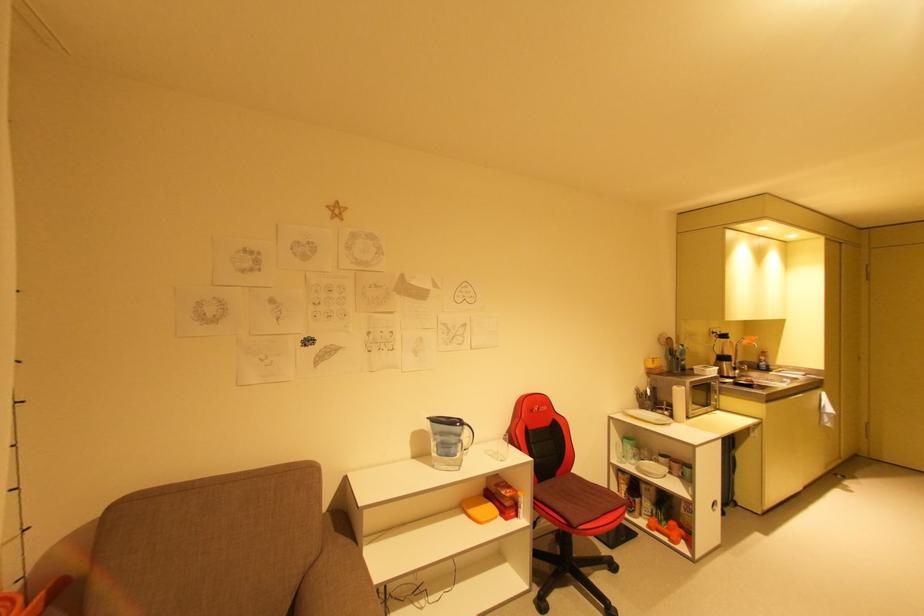
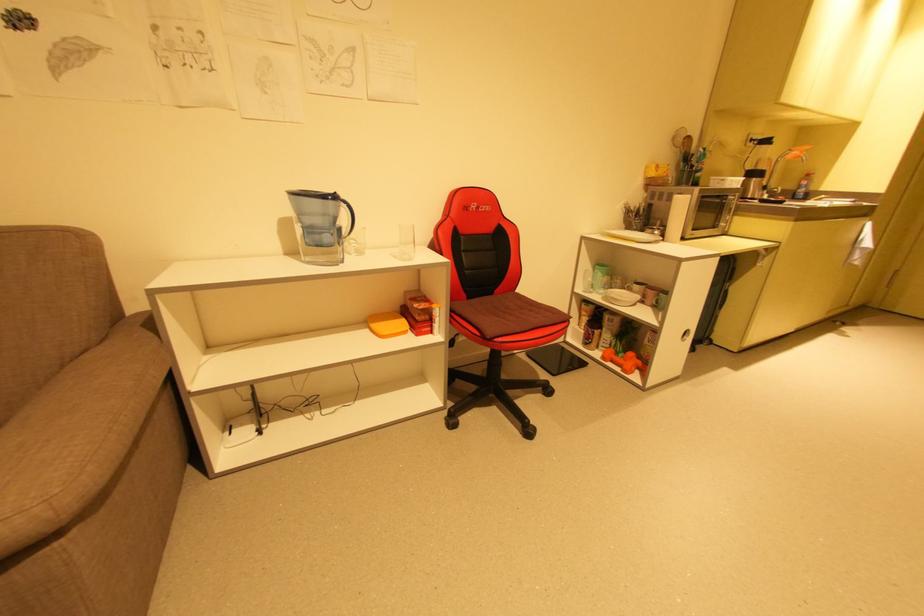
In the second image, find the point that corresponds to [647,462] in the first image.

(616, 290)